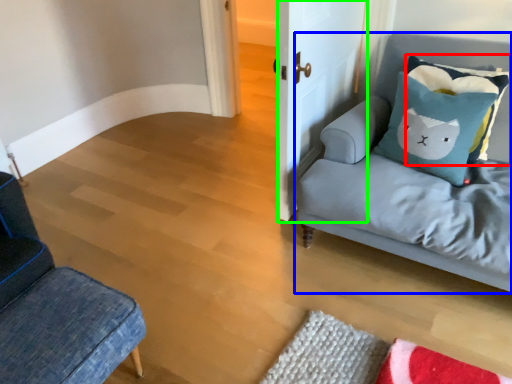
Question: Which is farther away from pillow (highlighted by a red box)? studio couch (highlighted by a blue box) or door (highlighted by a green box)?

Choices:
 (A) studio couch
 (B) door

Answer: (B)